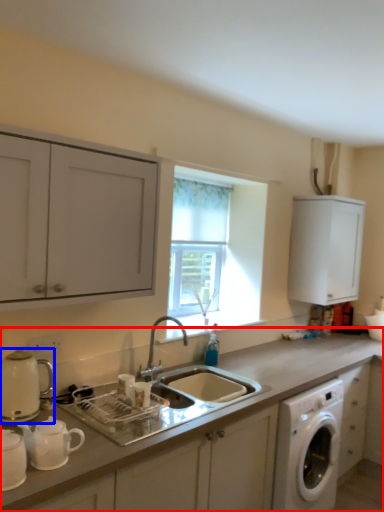
Question: Which of the following is the closest to the observer, countertop (highlighted by a red box) or appliance (highlighted by a blue box)?

Choices:
 (A) countertop
 (B) appliance

Answer: (A)